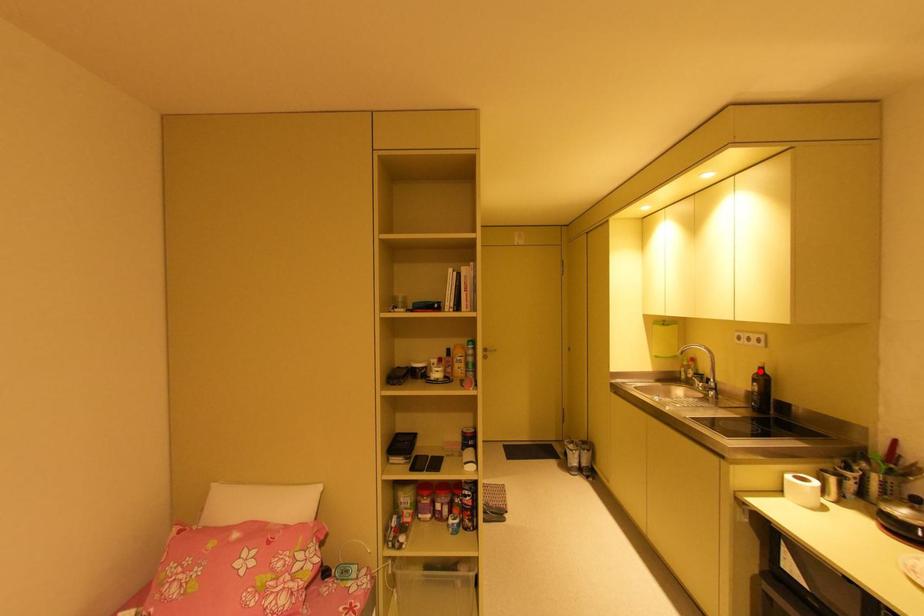
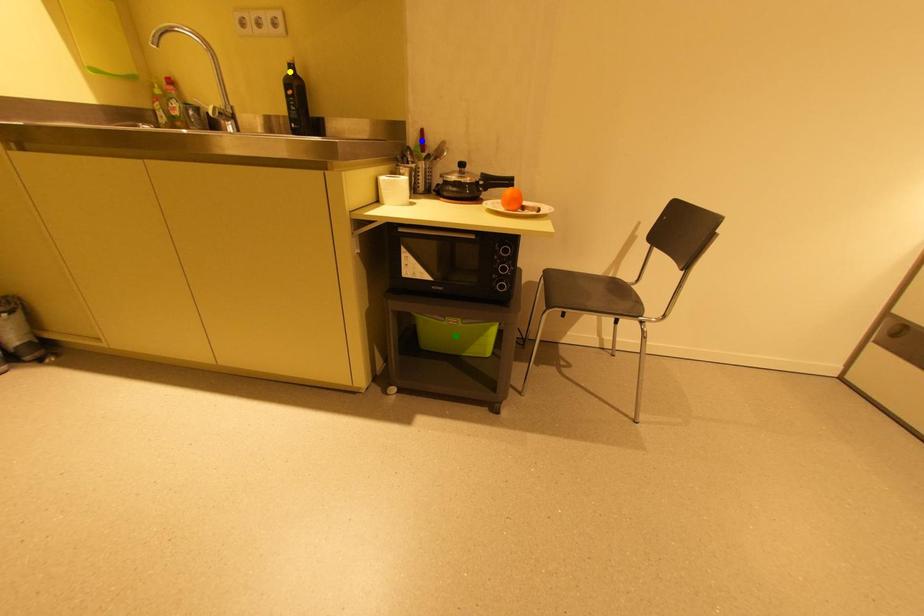
Question: I am providing you with two images of the same scene from different viewpoints. A red point is marked on the first image. You are given multiple points on the second image. In image 2, which mark is for the same physical point as the one in image 1?

Choices:
 (A) green point
 (B) blue point
 (C) yellow point

Answer: (C)